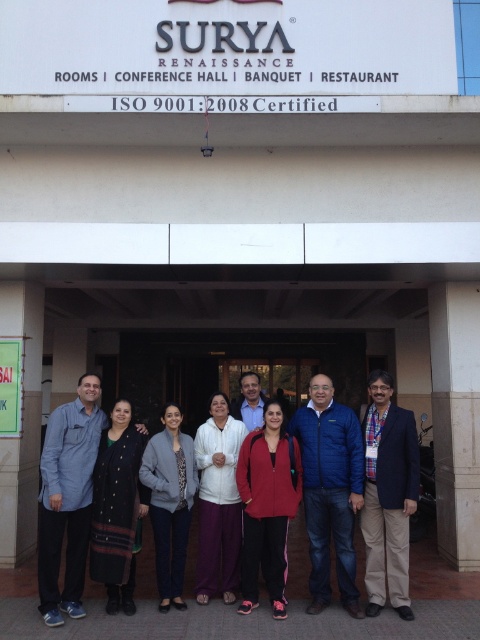
You are a photographer taking a picture of the group in front of the SURYA RENAISSANCE building. You notice the black woolen shawl at center and the green paper at left. Which object is positioned more to the left side of the image?

The green paper at left is positioned more to the left side of the image.

Consider the image. You are standing at the entrance of the SURYA RENAISSANCE building and see two points marked on the ground. The first point is at coordinates point (73, 480) and the second point is at point (3, 337). Which point is closer to you?

Point (73, 480) is in front of point (3, 337), so it is closer to you.